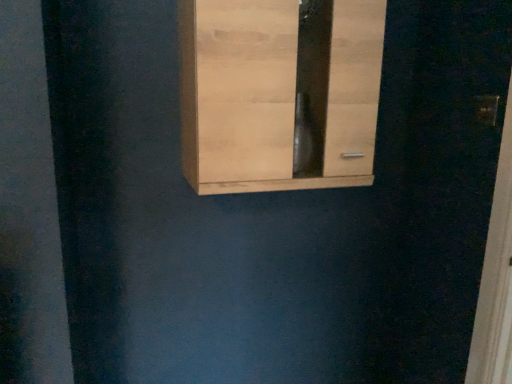
Where is `natural wood cupboard at upper center`? The image size is (512, 384). natural wood cupboard at upper center is located at coordinates (277, 92).

What do you see at coordinates (277, 92) in the screenshot?
I see `natural wood cupboard at upper center` at bounding box center [277, 92].

Identify the location of natural wood cupboard at upper center. This screenshot has width=512, height=384. (x=277, y=92).